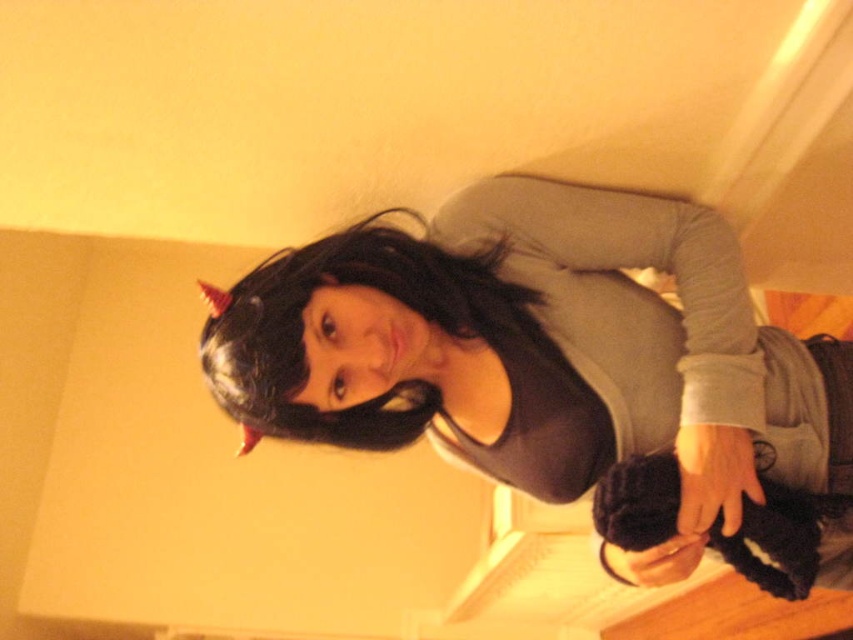
You are a photographer setting up a lighting setup for a portrait. You notice two objects in the frame, the black matte wig at upper center and the black matte hair at upper center. Which object should you adjust your lights to highlight more, considering their size?

The black matte wig at upper center is bigger than the black matte hair at upper center, so you should adjust your lights to highlight the black matte wig at upper center more because it is larger and might require more emphasis in the composition.

You are a photographer trying to adjust the lighting for a portrait. You notice the black matte wig at upper center and the gray matte shirt at upper center. Which object is covering part of the other?

The black matte wig at upper center is positioned over the gray matte shirt at upper center, so the wig is covering part of the shirt.

Where is the black matte wig at upper center located in the image?

The black matte wig at upper center is located at point [538,353] in the image.